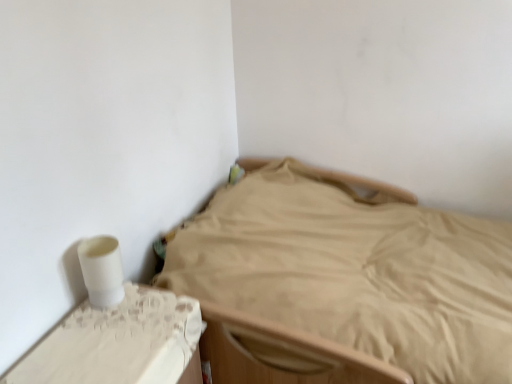
I want to click on vacant region above white lace table at lower left (from a real-world perspective), so click(114, 337).